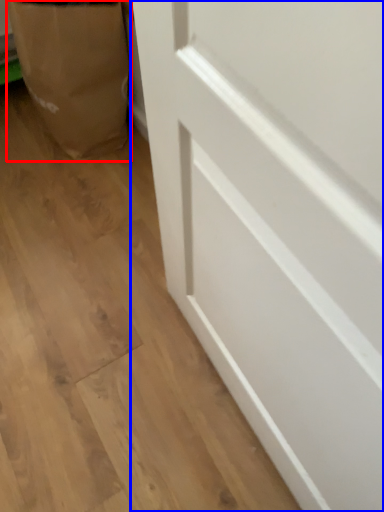
Question: Which object is closer to the camera taking this photo, paper bag (highlighted by a red box) or door (highlighted by a blue box)?

Choices:
 (A) paper bag
 (B) door

Answer: (B)